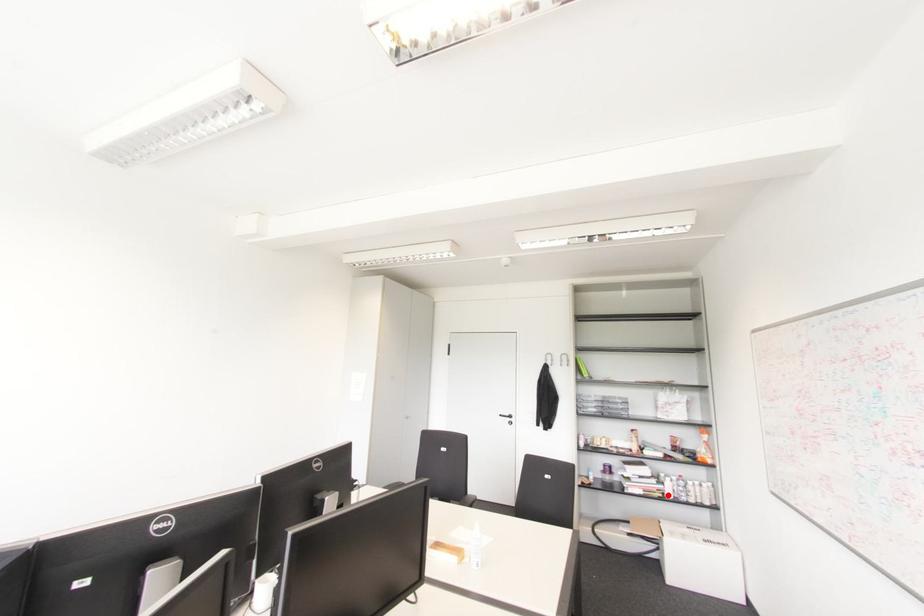
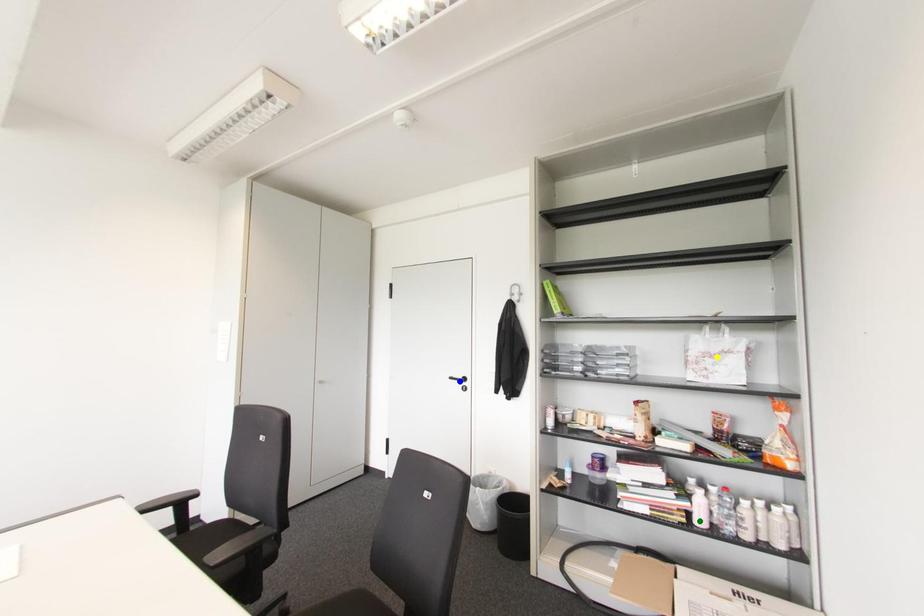
Question: I am providing you with two images of the same scene from different viewpoints. A red point is marked on the first image. You are given multiple points on the second image. Can you choose the point in image 2 that corresponds to the point in image 1?

Choices:
 (A) blue point
 (B) yellow point
 (C) green point

Answer: (C)